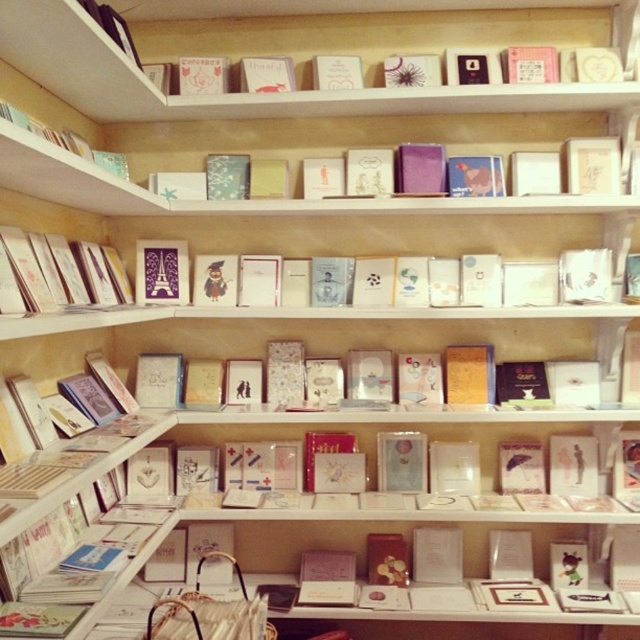
Question: Which object is closer to the camera taking this photo?

Choices:
 (A) matte pink card at upper center
 (B) matte paper greeting card at left
 (C) matte pink card at center

Answer: (B)

Question: Is matte pink card at center positioned in front of matte pink card at upper center?

Choices:
 (A) yes
 (B) no

Answer: (B)

Question: Is matte pink card at center above matte pink card at upper center?

Choices:
 (A) no
 (B) yes

Answer: (A)

Question: Is matte pink card at center bigger than matte pink card at upper center?

Choices:
 (A) no
 (B) yes

Answer: (B)

Question: Which of these objects is positioned closest to the matte paper greeting card at left?

Choices:
 (A) matte pink card at center
 (B) matte pink card at upper center

Answer: (A)

Question: Which object is the farthest from the matte pink card at center?

Choices:
 (A) matte paper greeting card at left
 (B) matte pink card at upper center

Answer: (B)